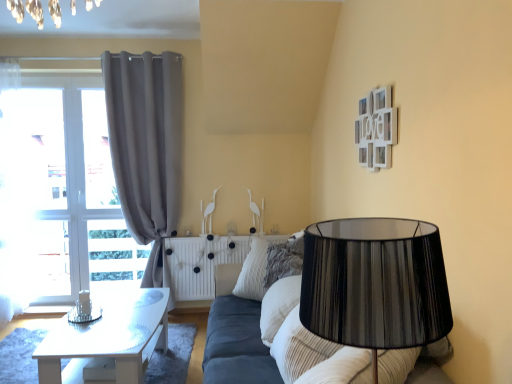
Question: Is white glossy table at left taller or shorter than striped fabric pillow at center?

Choices:
 (A) short
 (B) tall

Answer: (B)

Question: In the image, is white glossy table at left positioned in front of or behind striped fabric pillow at center?

Choices:
 (A) behind
 (B) front

Answer: (B)

Question: Estimate the real-world distances between objects in this image. Which object is closer to the black pleated lampshade at center?

Choices:
 (A) white wooden picture frame at upper right
 (B) white glossy table at left
 (C) striped fabric pillow at center
 (D) gray fabric curtain at left
 (E) white textured radiator at center

Answer: (A)

Question: Which object is positioned closest to the black pleated lampshade at center?

Choices:
 (A) gray fabric curtain at left
 (B) white glossy table at left
 (C) striped fabric pillow at center
 (D) white wooden picture frame at upper right
 (E) white textured radiator at center

Answer: (D)